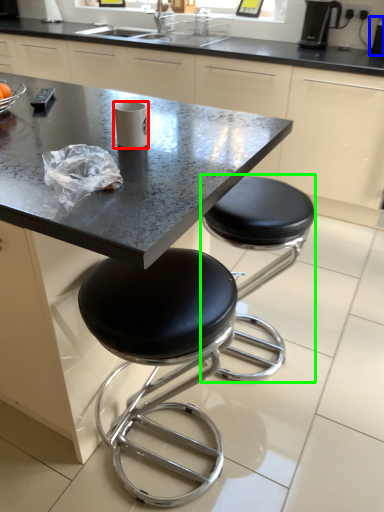
Question: Which object is the closest to the paper cup (highlighted by a red box)? Choose among these: appliance (highlighted by a blue box) or stool (highlighted by a green box).

Choices:
 (A) appliance
 (B) stool

Answer: (B)